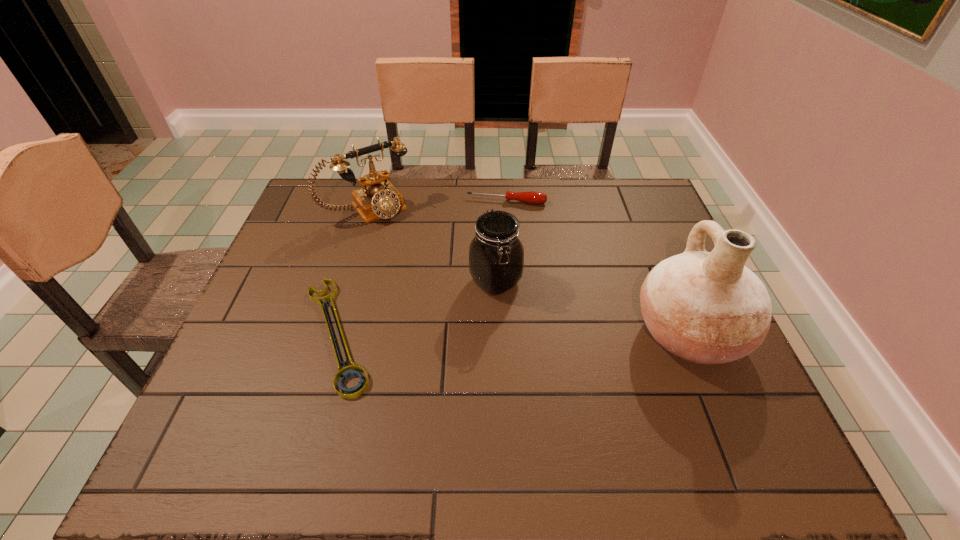
You are a GUI agent. You are given a task and a screenshot of the screen. Output one action in this format:
    pyautogui.click(x=<x>, y=<y>)
    Task: Click on the vacant area located at the tip of the fourth tallest object
    The width and height of the screenshot is (960, 540).
    Given the screenshot: What is the action you would take?
    (491, 273)

Where is `free space located 0.140m at the tip of the fourth tallest object`? Image resolution: width=960 pixels, height=540 pixels. free space located 0.140m at the tip of the fourth tallest object is located at coordinates (497, 235).

Locate an element on the screen. The image size is (960, 540). free space located 0.190m at the tip of the fourth tallest object is located at coordinates (495, 246).

At what (x,y) coordinates should I click in order to perform the action: click on free location located on the lid of the jar. Please return your answer as a coordinate pair (x, y). Looking at the image, I should click on (582, 356).

In order to click on blank area located 0.260m on the lid of the jar in this screenshot , I will do `click(592, 366)`.

In order to click on vacant region located on the lid of the jar in this screenshot , I will do [610, 381].

Identify the location of telephone at the far edge. (378, 198).

The width and height of the screenshot is (960, 540). Find the location of `screwdriver that is at the far edge`. screwdriver that is at the far edge is located at coordinates (532, 197).

Identify the location of wrench at the near edge. (354, 370).

Identify the location of pottery present at the near edge. The width and height of the screenshot is (960, 540). (708, 308).